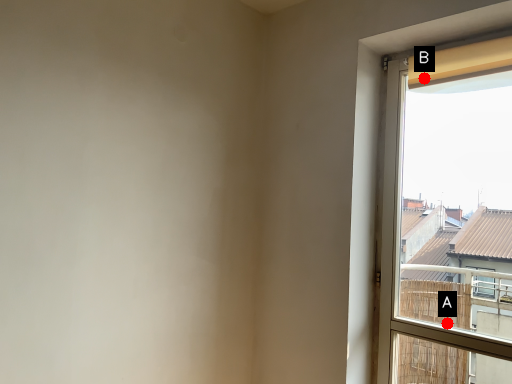
Question: Two points are circled on the image, labeled by A and B beside each circle. Among these points, which one is nearest to the camera?

Choices:
 (A) A is closer
 (B) B is closer

Answer: (B)